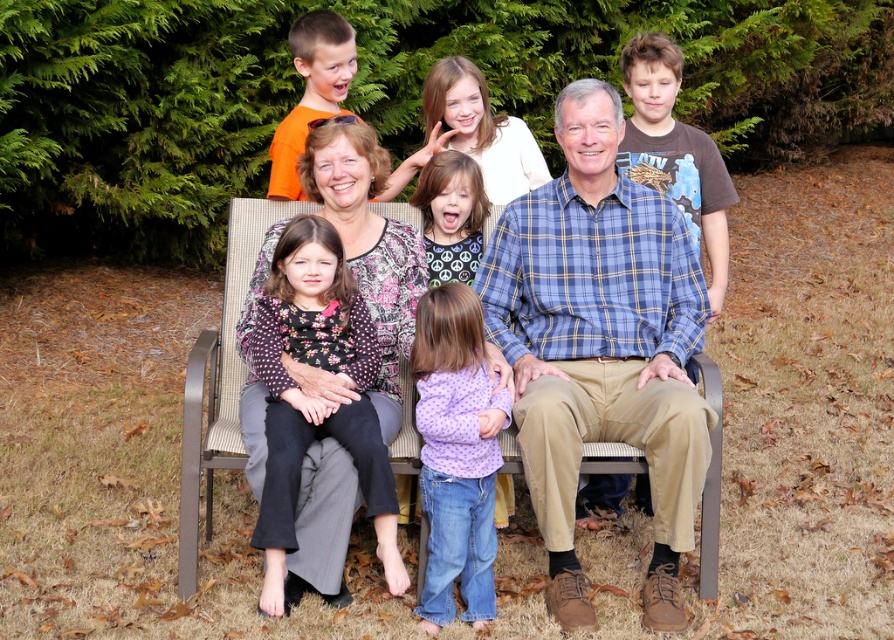
What is the color of the object located at point (600, 344)?

The object at point (600, 344) is the matte plaid shirt at center, which is described as having a plaid pattern but the specific color isn not mentioned in the provided information.